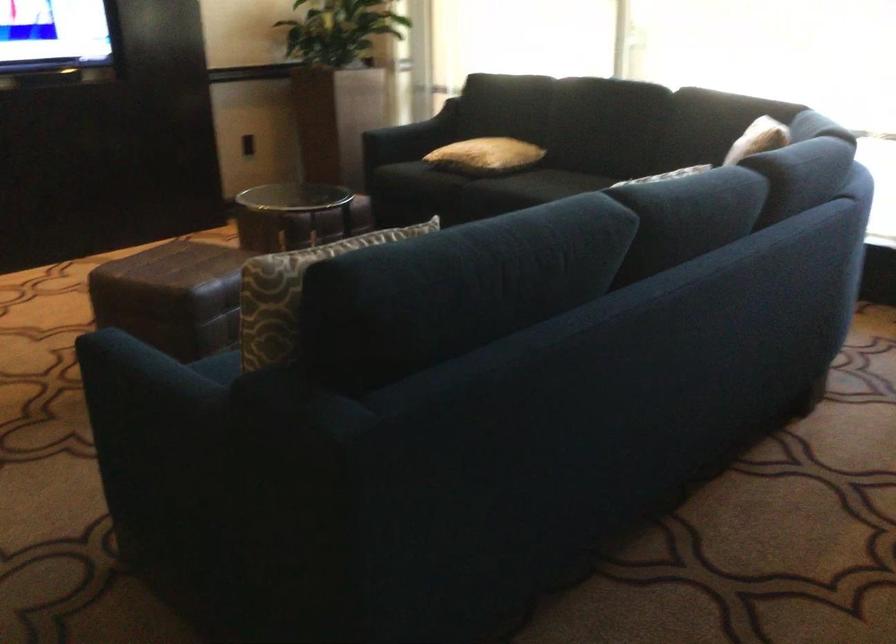
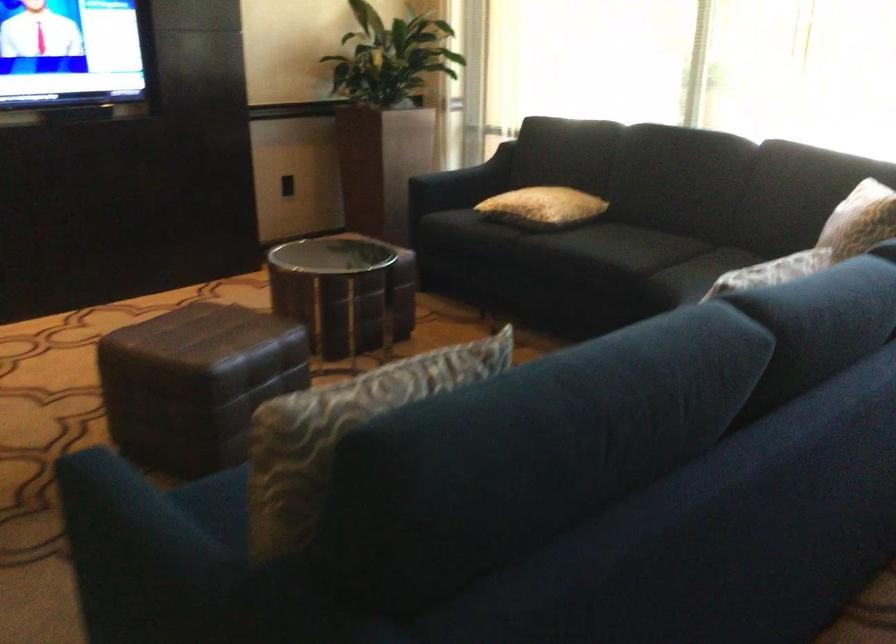
Where in the second image is the point corresponding to point 179,304 from the first image?

(195, 383)